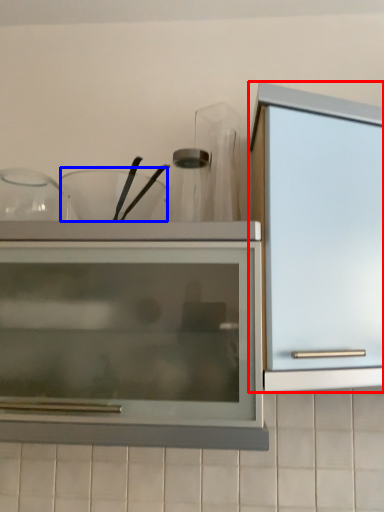
Question: Which point is further to the camera, cabinetry (highlighted by a red box) or tableware (highlighted by a blue box)?

Choices:
 (A) cabinetry
 (B) tableware

Answer: (B)